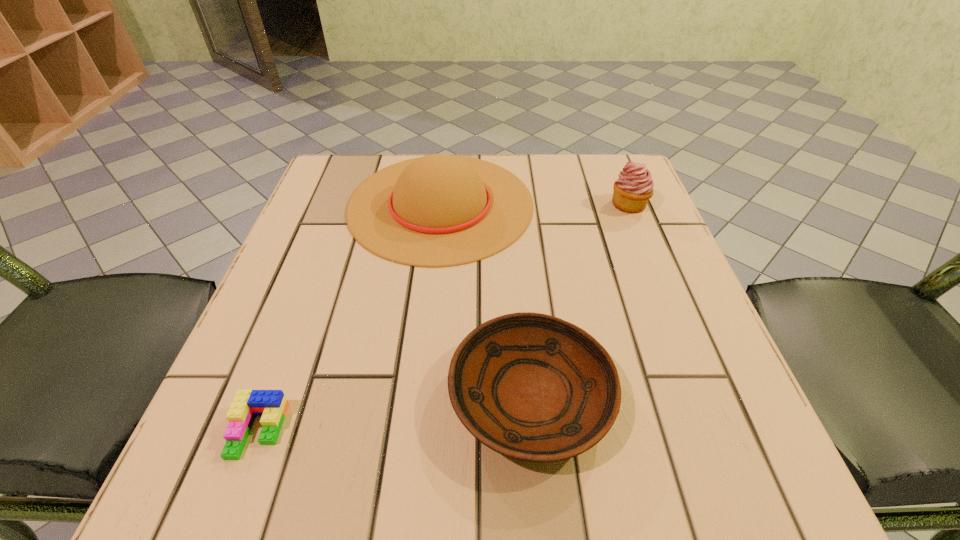
Locate an element on the screen. free spot at the left edge of the desktop is located at coordinates (328, 312).

You are a GUI agent. You are given a task and a screenshot of the screen. Output one action in this format:
    pyautogui.click(x=<x>, y=<y>)
    Task: Click on the free space at the right edge of the desktop
    The height and width of the screenshot is (540, 960).
    Given the screenshot: What is the action you would take?
    pyautogui.click(x=636, y=314)

You are a GUI agent. You are given a task and a screenshot of the screen. Output one action in this format:
    pyautogui.click(x=<x>, y=<y>)
    Task: Click on the vacant space at the far left corner
    The image size is (960, 540).
    Given the screenshot: What is the action you would take?
    pyautogui.click(x=336, y=166)

You are a GUI agent. You are given a task and a screenshot of the screen. Output one action in this format:
    pyautogui.click(x=<x>, y=<y>)
    Task: Click on the vacant space at the far right corner
    This screenshot has width=960, height=540.
    Given the screenshot: What is the action you would take?
    pyautogui.click(x=588, y=175)

Locate an element on the screen. The width and height of the screenshot is (960, 540). vacant space that's between the cupcake and the shortest object is located at coordinates (x=444, y=318).

Find the location of a particular element. free point between the plate and the shortest object is located at coordinates (395, 413).

You are a GUI agent. You are given a task and a screenshot of the screen. Output one action in this format:
    pyautogui.click(x=<x>, y=<y>)
    Task: Click on the vacant area between the rightmost object and the shortest object
    This screenshot has width=960, height=540.
    Given the screenshot: What is the action you would take?
    tap(444, 318)

Where is `free area in between the sombrero and the shortest object`? Image resolution: width=960 pixels, height=540 pixels. free area in between the sombrero and the shortest object is located at coordinates (349, 317).

Identify the location of free space that is in between the Lego and the rightmost object. click(444, 318).

Find the location of a particular element. The width and height of the screenshot is (960, 540). empty location between the sombrero and the plate is located at coordinates (486, 300).